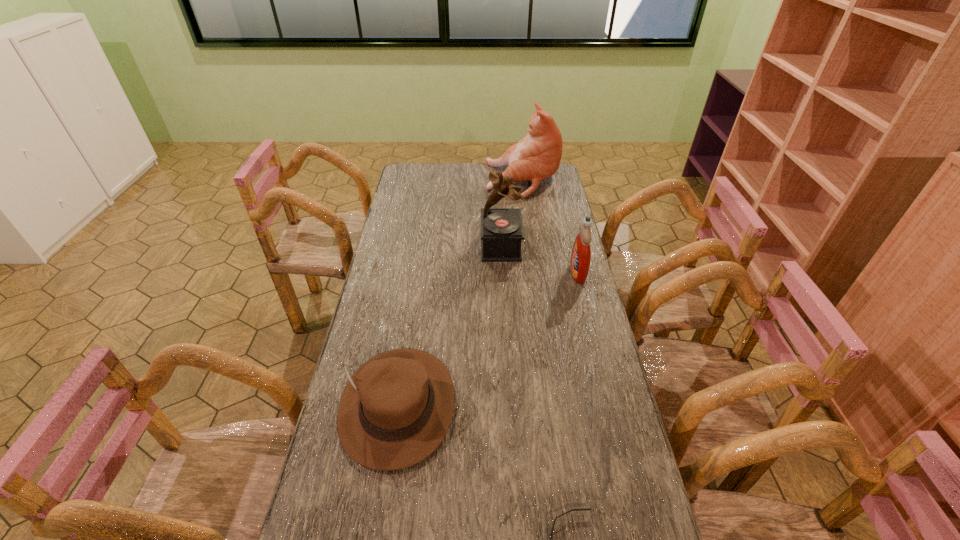
I want to click on object that is the closest to the second nearest object, so click(x=551, y=537).

Find the location of a particular element. The width and height of the screenshot is (960, 540). vacant region that satisfies the following two spatial constraints: 1. at the horn opening of the phonograph_record; 2. on the feather side of the leftmost object is located at coordinates (510, 406).

You are a GUI agent. You are given a task and a screenshot of the screen. Output one action in this format:
    pyautogui.click(x=<x>, y=<y>)
    Task: Click on the vacant space that satisfies the following two spatial constraints: 1. at the horn opening of the phonograph_record; 2. on the feather side of the leftmost object
    
    Given the screenshot: What is the action you would take?
    pyautogui.click(x=510, y=406)